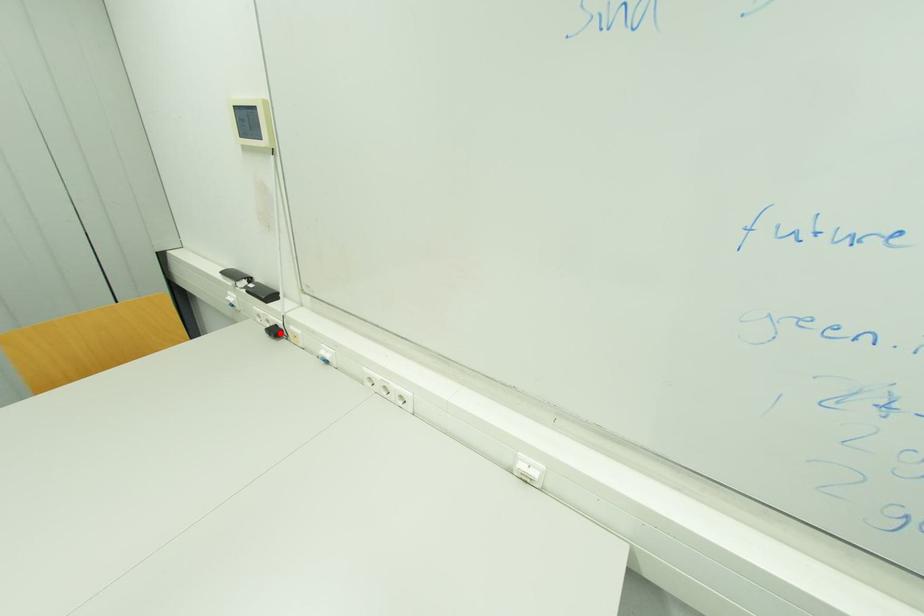
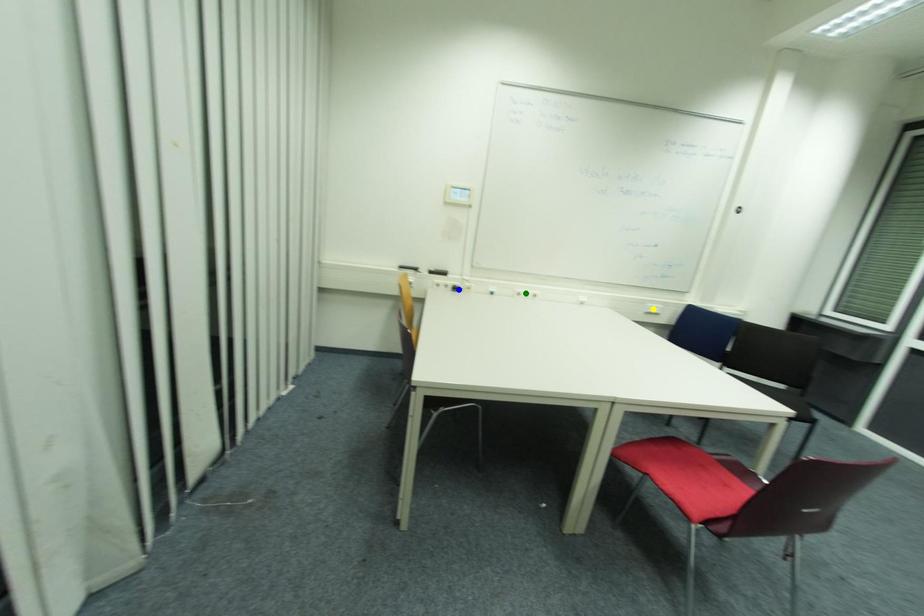
Question: I am providing you with two images of the same scene from different viewpoints. A red point is marked on the first image. You are given multiple points on the second image. Can you choose the point in image 2 that corresponds to the point in image 1?

Choices:
 (A) yellow point
 (B) blue point
 (C) green point

Answer: (B)